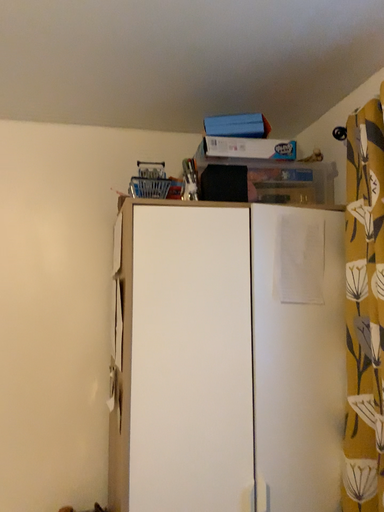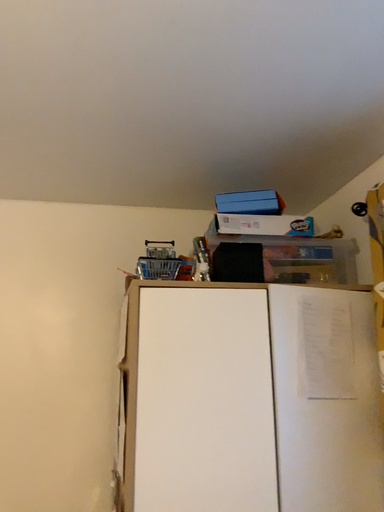
Question: Which way did the camera rotate in the video?

Choices:
 (A) rotated downward
 (B) rotated upward

Answer: (B)